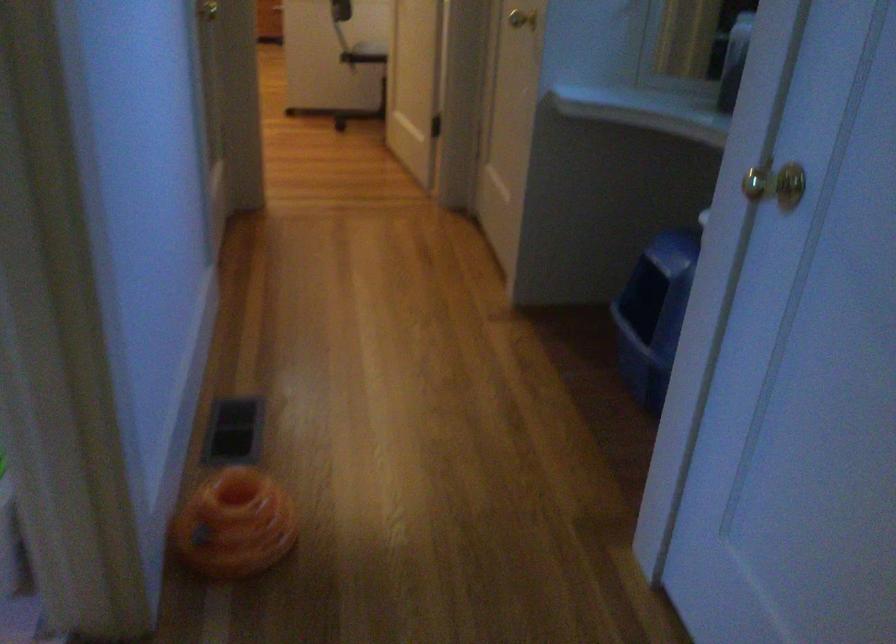
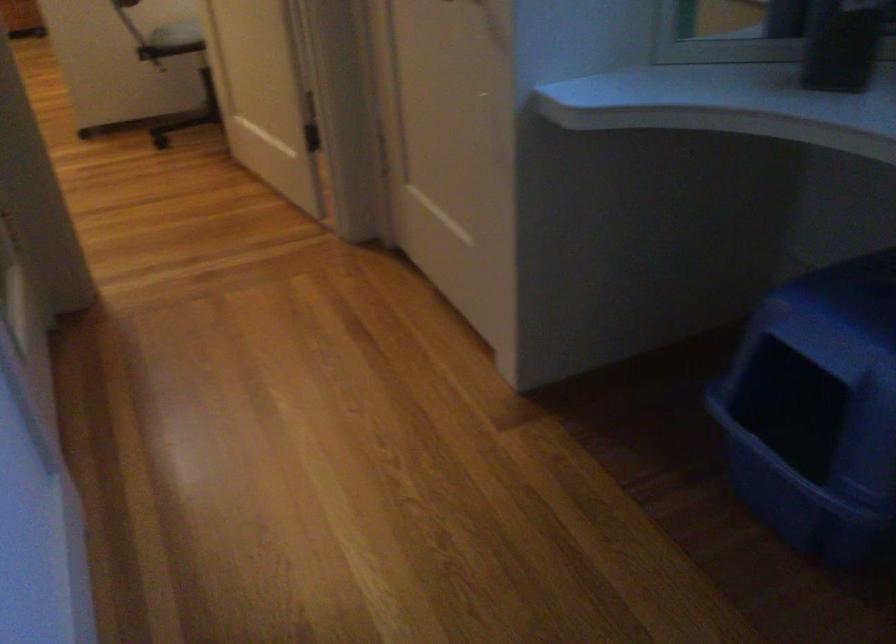
Question: Which direction would the cameraman need to move to produce the second image? Reply with the corresponding letter.

Choices:
 (A) Left
 (B) Right
 (C) Forward
 (D) Backward

Answer: (C)